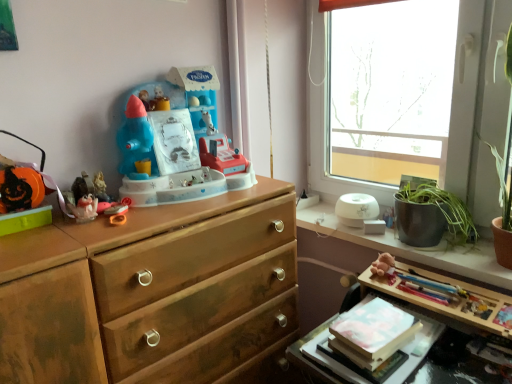
Question: Looking at the image, does wooden table at lower right seem bigger or smaller compared to matte plastic toy at left, which is the 3th toy from right to left?

Choices:
 (A) big
 (B) small

Answer: (A)

Question: Based on their positions, is wooden table at lower right located to the left or right of matte plastic toy at left, acting as the second toy starting from the left?

Choices:
 (A) left
 (B) right

Answer: (B)

Question: Estimate the real-world distances between objects in this image. Which object is farther from the plastic toy at center, acting as the fourth toy starting from the left?

Choices:
 (A) wooden table at lower right
 (B) brown plush toy at upper right
 (C) transparent glass window at upper right
 (D) green leafy plant at window sill
 (E) wooden knob at center

Answer: (D)

Question: Estimate the real-world distances between objects in this image. Which object is farther from the transparent glass window at upper right?

Choices:
 (A) matte plastic figurine at left, which is the third toy in left-to-right order
 (B) white matte book at lower right
 (C) white glossy humidifier at upper right
 (D) green leafy plant at window sill
 (E) wooden knob at center

Answer: (E)